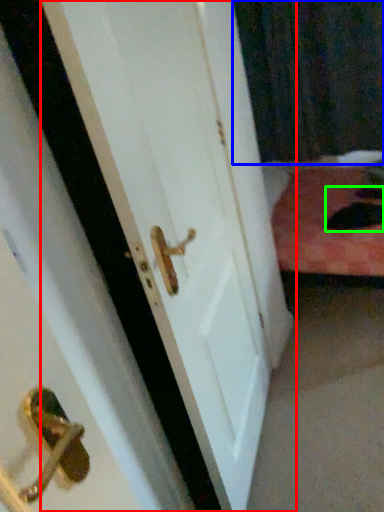
Question: Which is nearer to the door (highlighted by a red box)? curtain (highlighted by a blue box) or cat (highlighted by a green box).

Choices:
 (A) curtain
 (B) cat

Answer: (B)